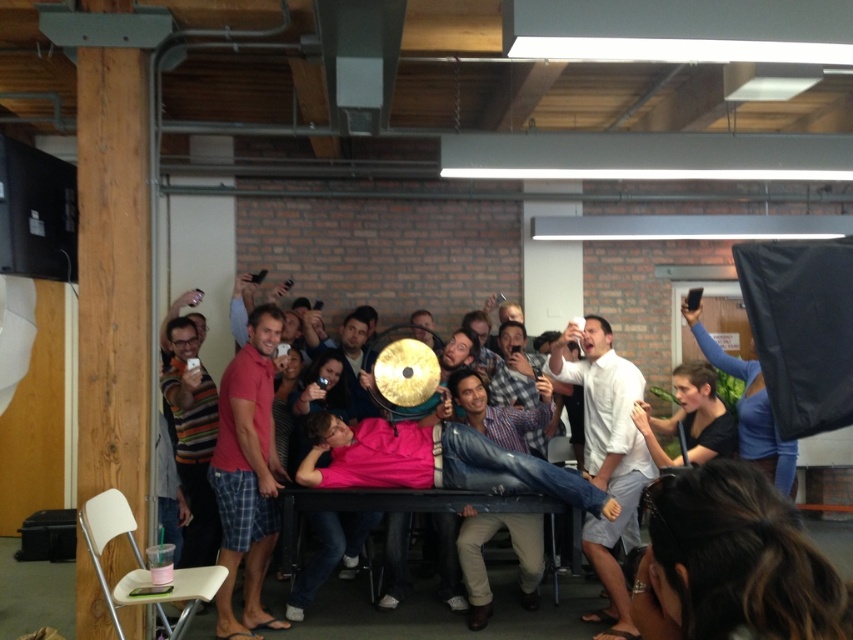
Question: Which of these objects is positioned farthest from the red plaid shorts at left?

Choices:
 (A) smooth black shirt at center
 (B) white matte shirt at center

Answer: (A)

Question: Considering the real-world distances, which object is farthest from the white matte shirt at center?

Choices:
 (A) smooth black shirt at center
 (B) red plaid shorts at left

Answer: (B)

Question: Does red plaid shorts at left appear under white matte shirt at center?

Choices:
 (A) no
 (B) yes

Answer: (A)

Question: Which is nearer to the white matte shirt at center?

Choices:
 (A) red plaid shorts at left
 (B) smooth black shirt at center

Answer: (B)

Question: Is white matte shirt at center thinner than smooth black shirt at center?

Choices:
 (A) no
 (B) yes

Answer: (B)

Question: Is red plaid shorts at left smaller than smooth black shirt at center?

Choices:
 (A) no
 (B) yes

Answer: (A)